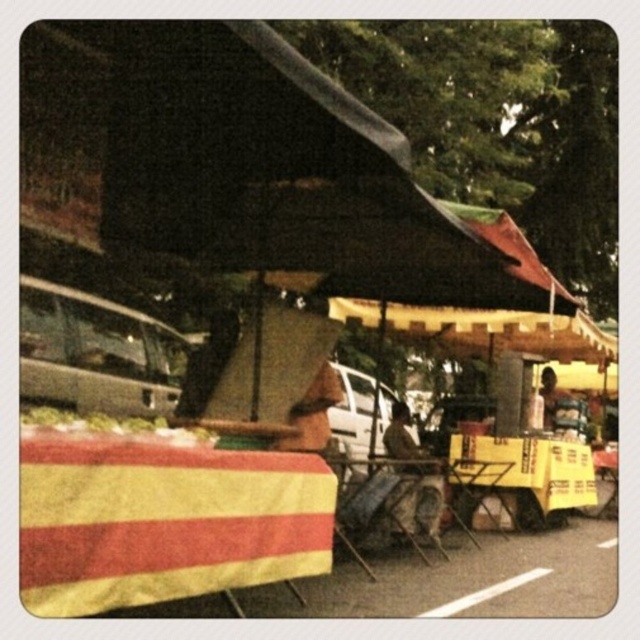
Question: Does green leafy vegetables at lower left appear on the right side of brown leather jacket at upper right?

Choices:
 (A) yes
 (B) no

Answer: (B)

Question: Which point appears closest to the camera in this image?

Choices:
 (A) (556, 460)
 (B) (550, 417)
 (C) (120, 428)
 (D) (218, 493)

Answer: (D)

Question: Which point is farther to the camera?

Choices:
 (A) yellow/red striped fabric at center
 (B) yellow paper sign at lower right
 (C) green leafy vegetables at lower left

Answer: (B)

Question: Is green leafy vegetables at lower left wider than brown leather jacket at upper right?

Choices:
 (A) no
 (B) yes

Answer: (B)

Question: Is yellow/red striped fabric at center wider than brown leather jacket at upper right?

Choices:
 (A) yes
 (B) no

Answer: (A)

Question: Which point is closer to the camera?

Choices:
 (A) coord(547,384)
 (B) coord(144,429)

Answer: (B)